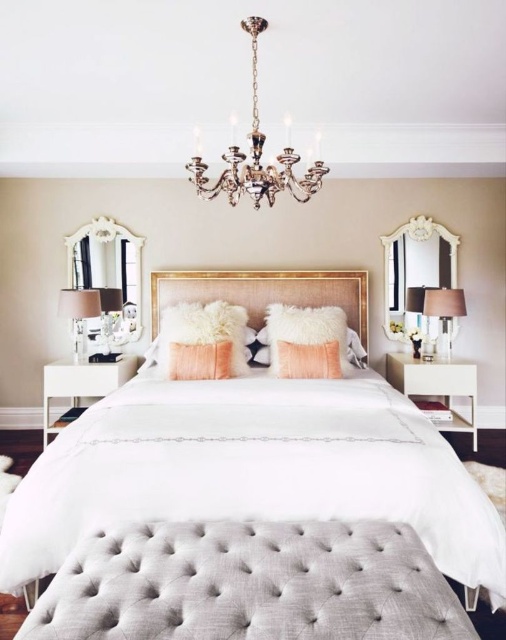
You are arranging flowers in the bedroom and want to place a vase between the peachy velvet pillow at center and the matte black lampshade at right. Based on their positions, where should the vase be placed relative to the two items?

The vase should be placed between the peachy velvet pillow at center and the matte black lampshade at right since the peachy velvet pillow at center is below the matte black lampshade at right, so placing the vase in between them would maintain a balanced arrangement.

You are organizing a small event in the bedroom and need to place a decorative vase on the ottoman. To ensure the vase doesn not fall off, you want to know the position of the ottoman relative to the pillow. Where is the white tufted ottoman at lower center located in relation to the matte peach pillow at center?

The white tufted ottoman at lower center is positioned on the right side of the matte peach pillow at center, so placing the vase on the ottoman to the right of the pillow should be stable as long as the ottoman is level and secure.

You are arranging flowers in the bedroom and want to place a bouquet between the peachy velvet pillow at center and the matte black lampshade at right. Since the flowers need to be taller than both objects to be visible, will they need to be taller than the lampshade?

The peachy velvet pillow at center has a lesser height compared to matte black lampshade at right. Therefore, the bouquet must be taller than the matte black lampshade at right to be visible above both objects.